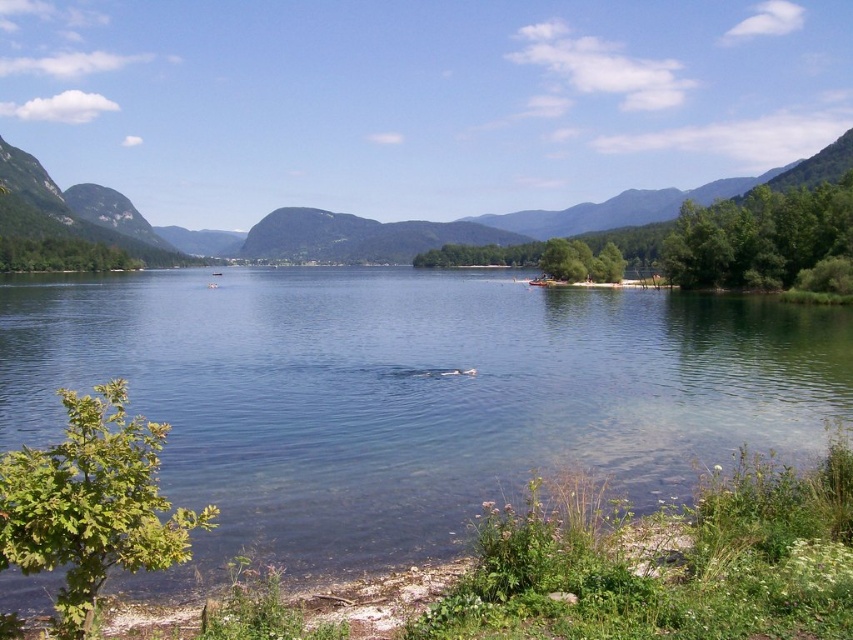
Question: Is clear blue water at center behind green forested mountain at center?

Choices:
 (A) yes
 (B) no

Answer: (B)

Question: Which object appears farthest from the camera in this image?

Choices:
 (A) clear blue water at center
 (B) green forested mountain at center

Answer: (B)

Question: Which object appears closest to the camera in this image?

Choices:
 (A) clear blue water at center
 (B) green forested mountain at center

Answer: (A)

Question: Can you confirm if clear blue water at center is bigger than green forested mountain at center?

Choices:
 (A) yes
 (B) no

Answer: (B)

Question: Is clear blue water at center wider than green forested mountain at center?

Choices:
 (A) yes
 (B) no

Answer: (B)